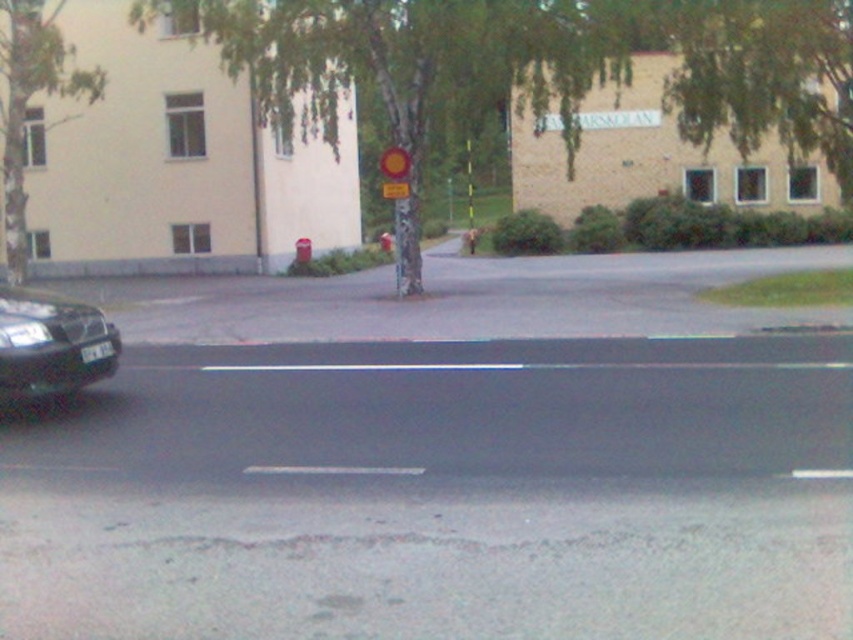
You are standing at the center of the image. Which direction should you walk to reach the green bark tree at center?

The green bark tree at center is already at the center of the image, so you are already facing it. No need to move in any direction.

From the picture: You are a pedestrian trying to cross the street. You notice the shiny black car at left and the yellow matte circle at center. Which object takes up more visual space in your view?

The yellow matte circle at center takes up more visual space than the shiny black car at left.

You are a delivery drone flying over an urban street scene. You need to land precisely at the point with coordinates (766, 76). Based on the scene description, what object or feature should you aim for to ensure a safe landing?

The point (766, 76) corresponds to the green leafy tree at upper center. You should aim for the green leafy tree at upper center to ensure a safe landing.